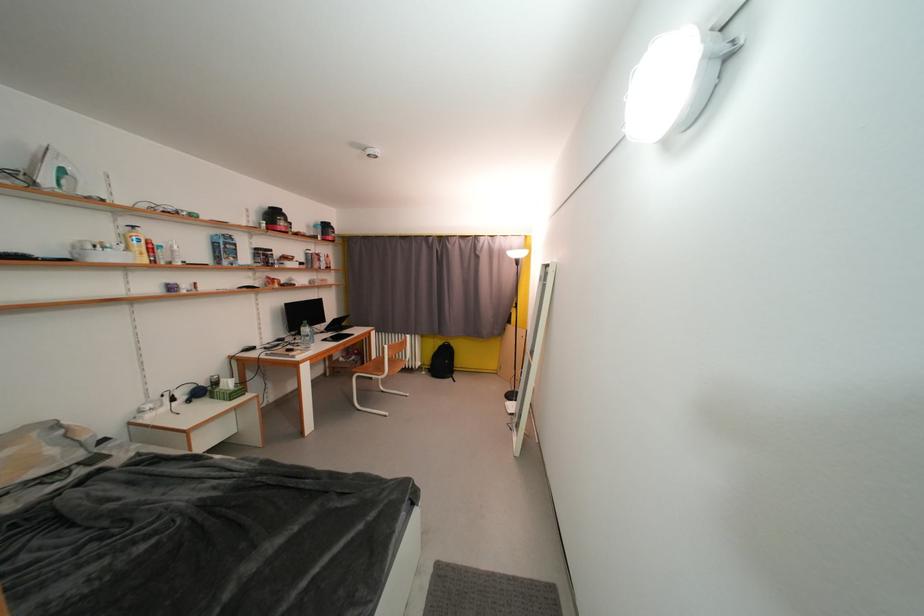
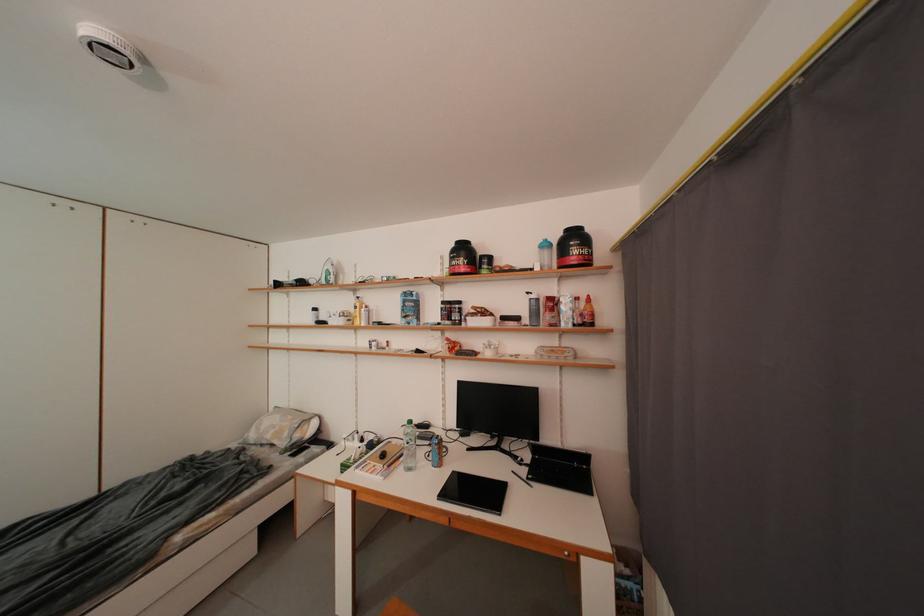
The point at (322, 229) is marked in the first image. Where is the corresponding point in the second image?

(553, 249)